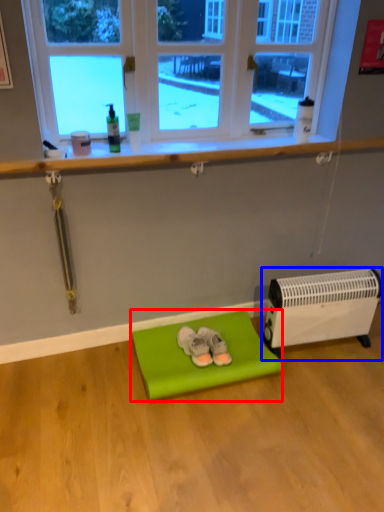
Question: Which object appears closest to the camera in this image, furniture (highlighted by a red box) or heater (highlighted by a blue box)?

Choices:
 (A) furniture
 (B) heater

Answer: (A)